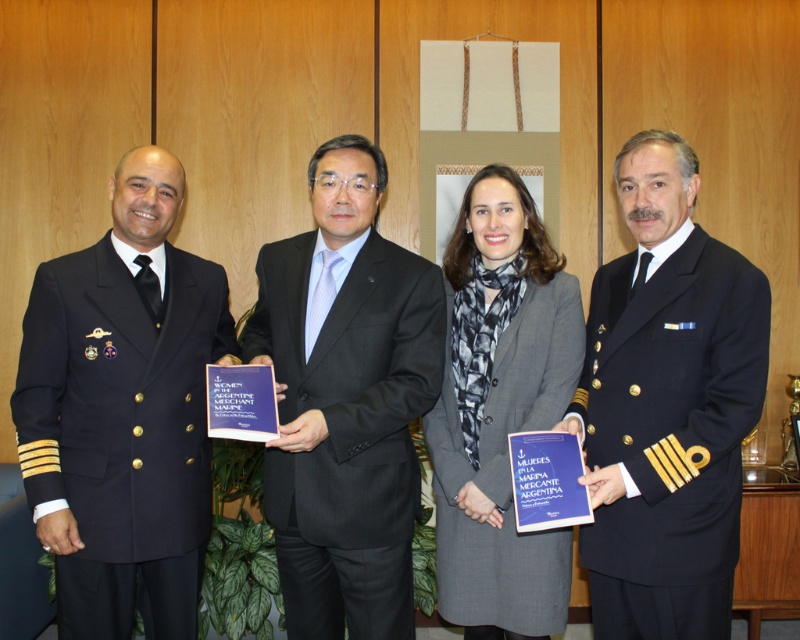
You are organizing a seating arrangement for a formal event and need to place the navy blue woolen suit at right and the gray wool coat at center. Which of these two garments has a bigger size?

The navy blue woolen suit at right has a larger size compared to the gray wool coat at center.

You are a photographer at a formal event and need to adjust the camera focus. The black wool suit at center and the gray wool coat at center are part of the subjects. How far apart are these two clothing items?

The black wool suit at center is 12.44 inches away from the gray wool coat at center.

Looking at this image, you are a photographer standing in front of the black wool suit at center. You need to take a photo of it without moving closer than 1.8 meters. Can you do it?

The distance between you and the black wool suit at center is 1.81 meters, so yes, you can take the photo without moving closer than 1.8 meters.